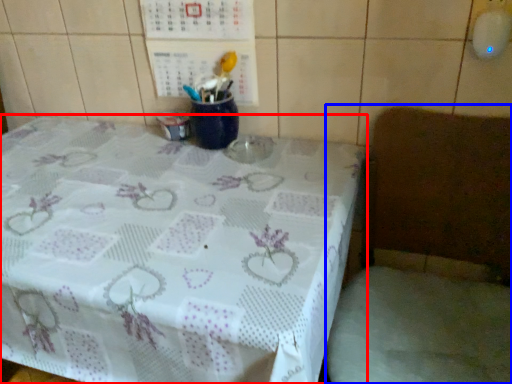
Question: Which object is closer to the camera taking this photo, table (highlighted by a red box) or chair (highlighted by a blue box)?

Choices:
 (A) table
 (B) chair

Answer: (B)